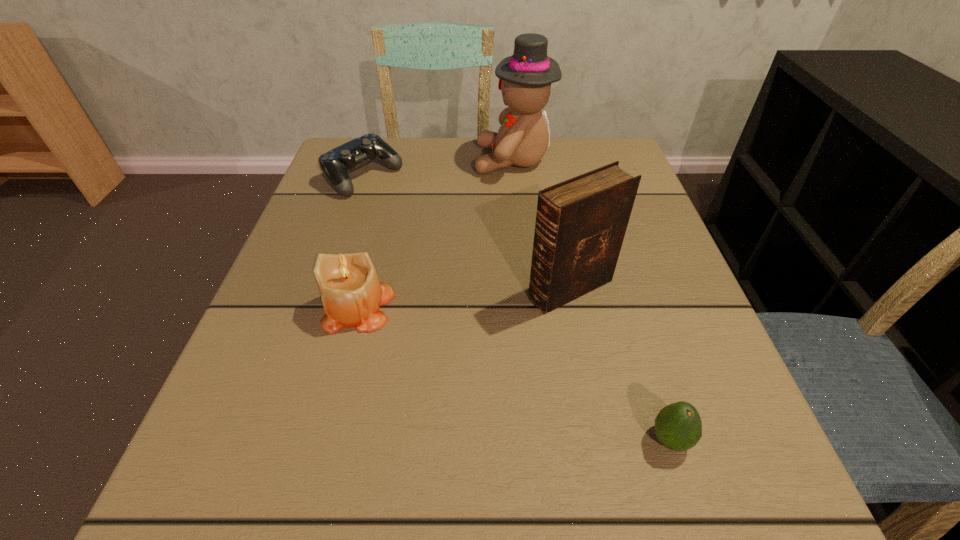
At what (x,y) coordinates should I click in order to perform the action: click on rag_doll. Please return your answer as a coordinate pair (x, y). Looking at the image, I should click on (525, 78).

You are a GUI agent. You are given a task and a screenshot of the screen. Output one action in this format:
    pyautogui.click(x=<x>, y=<y>)
    Task: Click on the Bible
    
    Given the screenshot: What is the action you would take?
    coord(580,226)

Identify the location of the third shortest object. click(351, 294).

This screenshot has height=540, width=960. Find the location of `avocado`. avocado is located at coordinates (678, 426).

This screenshot has width=960, height=540. I want to click on control, so click(x=335, y=164).

Locate an element on the screen. vacant space located on the front-facing side of the tallest object is located at coordinates (401, 160).

At what (x,y) coordinates should I click in order to perform the action: click on vacant region located 0.080m on the front-facing side of the tallest object. Please return your answer as a coordinate pair (x, y). This screenshot has height=540, width=960. Looking at the image, I should click on coord(443,160).

I want to click on free location located on the front-facing side of the tallest object, so click(x=434, y=160).

The width and height of the screenshot is (960, 540). What are the coordinates of `free space located on the back of the fourth shortest object` in the screenshot? It's located at (554, 207).

This screenshot has height=540, width=960. In order to click on vacant space positioned 0.310m on the back of the candle in this screenshot , I will do `click(392, 184)`.